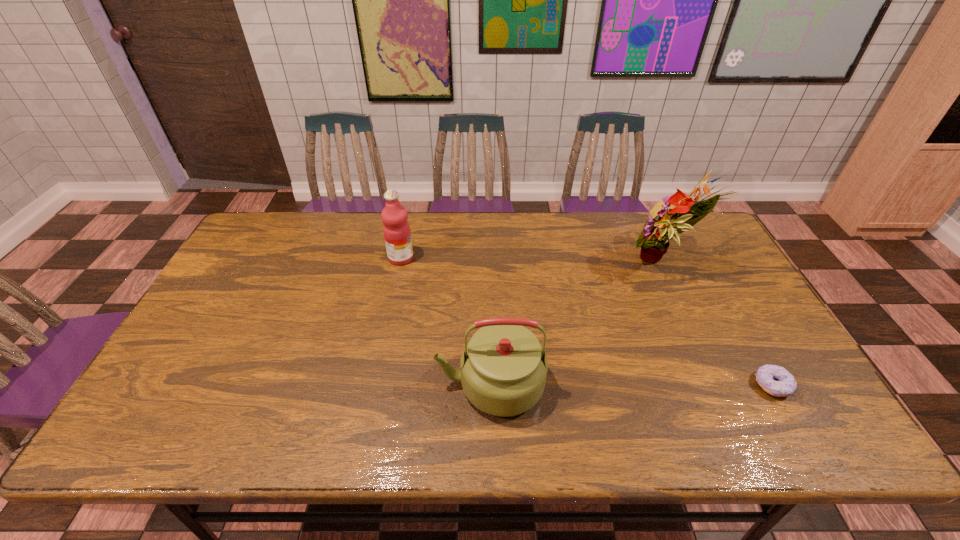
Where is `bouquet`? This screenshot has height=540, width=960. bouquet is located at coordinates (654, 239).

Find the location of a particular element. This screenshot has height=540, width=960. fruit juice is located at coordinates (396, 229).

Where is `kettle`? kettle is located at coordinates (503, 373).

I want to click on doughnut, so click(x=775, y=380).

You are a GUI agent. You are given a task and a screenshot of the screen. Output one action in this format:
    pyautogui.click(x=<x>, y=<y>)
    Task: Click on the vacant space located 0.140m on the front-facing side of the bouquet
    
    Given the screenshot: What is the action you would take?
    pyautogui.click(x=579, y=263)

In order to click on vacant area situated on the front-facing side of the bouquet in this screenshot , I will do click(x=550, y=263).

Locate an element on the screen. The image size is (960, 540). free location located on the front-facing side of the bouquet is located at coordinates (566, 263).

I want to click on vacant space positioned 0.240m on the label of the leftmost object, so click(489, 258).

Find the location of a particular element. vacant region located 0.400m at the spout of the kettle is located at coordinates (272, 384).

Locate an element on the screen. free space located 0.390m at the spout of the kettle is located at coordinates (276, 384).